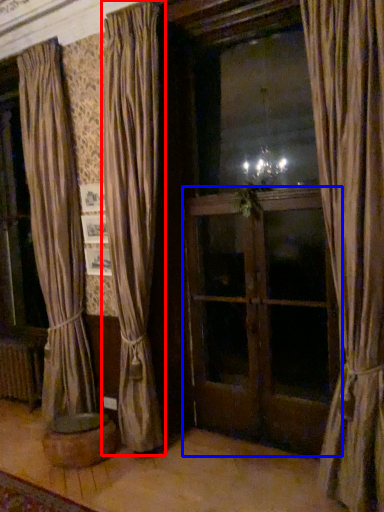
Question: Which point is closer to the camera, curtain (highlighted by a red box) or screen door (highlighted by a blue box)?

Choices:
 (A) curtain
 (B) screen door

Answer: (A)